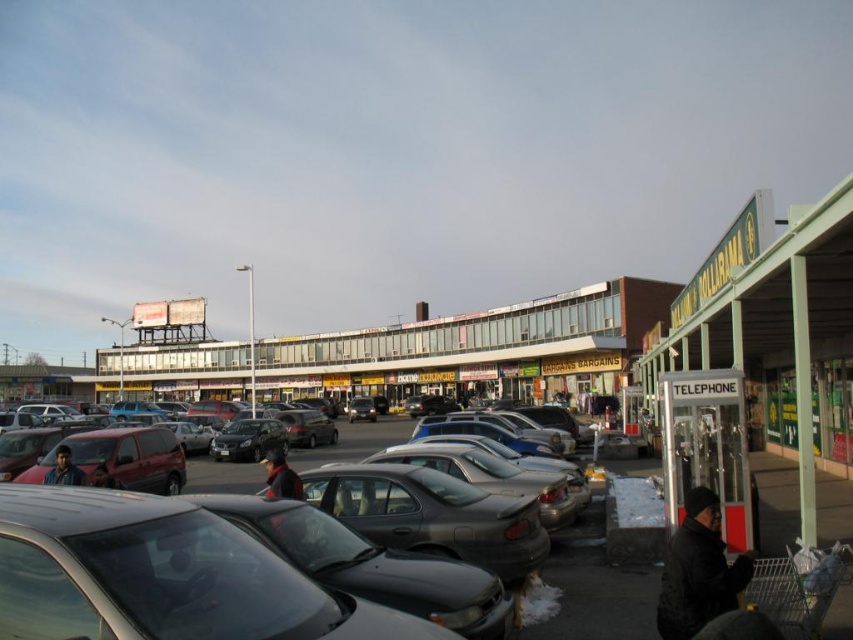
Is shiny gray car at center shorter than metallic gray sedan at center?

No, shiny gray car at center is not shorter than metallic gray sedan at center.

Who is shorter, shiny gray car at center or metallic gray sedan at center?

Standing shorter between the two is metallic gray sedan at center.

Find the location of `shiny gray car at center`. shiny gray car at center is located at coordinates (357, 444).

Find the location of a particular element. shiny gray car at center is located at coordinates (357, 444).

Is glassy storefronts at center wider than shiny gray car at center?

Yes, glassy storefronts at center is wider than shiny gray car at center.

Is glassy storefronts at center below shiny gray car at center?

Actually, glassy storefronts at center is above shiny gray car at center.

Where is `glassy storefronts at center`? The height and width of the screenshot is (640, 853). glassy storefronts at center is located at coordinates (415, 353).

Is glassy storefronts at center to the left of metallic gray sedan at center from the viewer's perspective?

Indeed, glassy storefronts at center is positioned on the left side of metallic gray sedan at center.

At what (x,y) coordinates should I click in order to perform the action: click on glassy storefronts at center. Please return your answer as a coordinate pair (x, y). The height and width of the screenshot is (640, 853). Looking at the image, I should click on (415, 353).